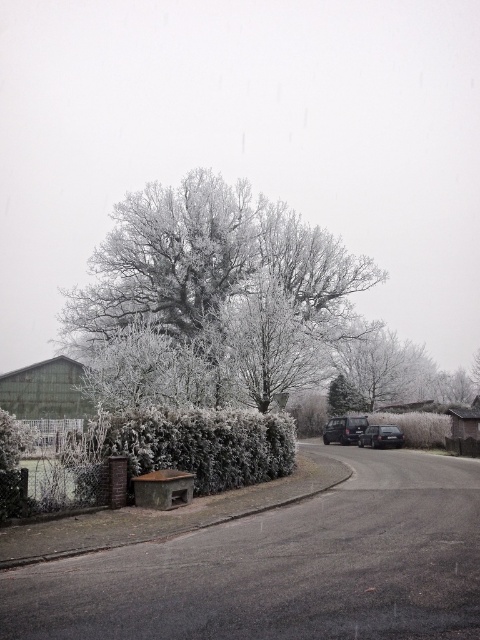
Is white frosty tree at center thinner than shiny black car at center?

No.

Between white frosty tree at center and shiny black car at center, which one has less height?

With less height is shiny black car at center.

Measure the distance between point (342, 413) and camera.

Point (342, 413) is 48.04 meters from camera.

Identify the location of white frosty tree at center. This screenshot has width=480, height=640. (345, 397).

Does dark gray metallic car at center have a lesser width compared to shiny black car at center?

Indeed, dark gray metallic car at center has a lesser width compared to shiny black car at center.

Is point (363, 422) farther from viewer compared to point (360, 440)?

Yes, it is.

You are a GUI agent. You are given a task and a screenshot of the screen. Output one action in this format:
    pyautogui.click(x=<x>, y=<y>)
    Task: Click on the dark gray metallic car at center
    This screenshot has width=480, height=640.
    Given the screenshot: What is the action you would take?
    pyautogui.click(x=344, y=428)

The width and height of the screenshot is (480, 640). What do you see at coordinates (345, 397) in the screenshot?
I see `white frosty tree at center` at bounding box center [345, 397].

Is point (336, 376) farther from camera compared to point (344, 436)?

Yes, it is behind point (344, 436).

At what (x,y) coordinates should I click in order to perform the action: click on white frosty tree at center. Please return your answer as a coordinate pair (x, y). Looking at the image, I should click on (345, 397).

The height and width of the screenshot is (640, 480). Identify the location of white frosty tree at center. coord(345,397).